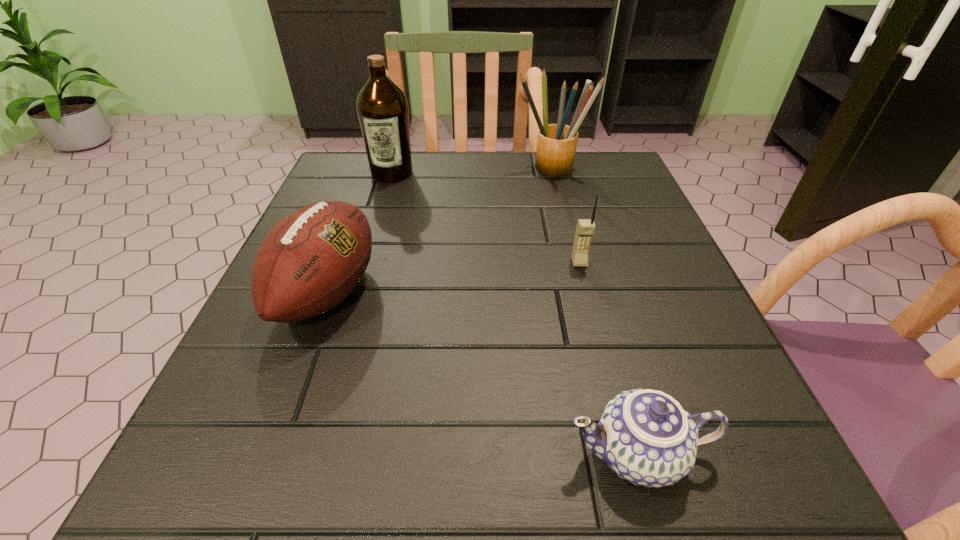
Identify the location of free spot between the cellular telephone and the olive oil. The height and width of the screenshot is (540, 960). (486, 218).

I want to click on free area in between the olive oil and the cellular telephone, so click(x=486, y=218).

Locate an element on the screen. empty space that is in between the chinaware and the football (American) is located at coordinates [483, 373].

Locate an element on the screen. Image resolution: width=960 pixels, height=540 pixels. free spot between the pencil box and the cellular telephone is located at coordinates (564, 216).

At what (x,y) coordinates should I click in order to perform the action: click on vacant point located between the olive oil and the chinaware. Please return your answer as a coordinate pair (x, y). This screenshot has width=960, height=540. Looking at the image, I should click on (515, 313).

Where is `free space between the olive oil and the cellular telephone`? This screenshot has width=960, height=540. free space between the olive oil and the cellular telephone is located at coordinates (486, 218).

The width and height of the screenshot is (960, 540). I want to click on vacant space that is in between the football (American) and the nearest object, so click(x=483, y=373).

Identify the location of the second closest object to the nearest object. This screenshot has height=540, width=960. (311, 260).

This screenshot has height=540, width=960. Identify the location of object that is the fourth nearest to the cellular telephone. (382, 108).